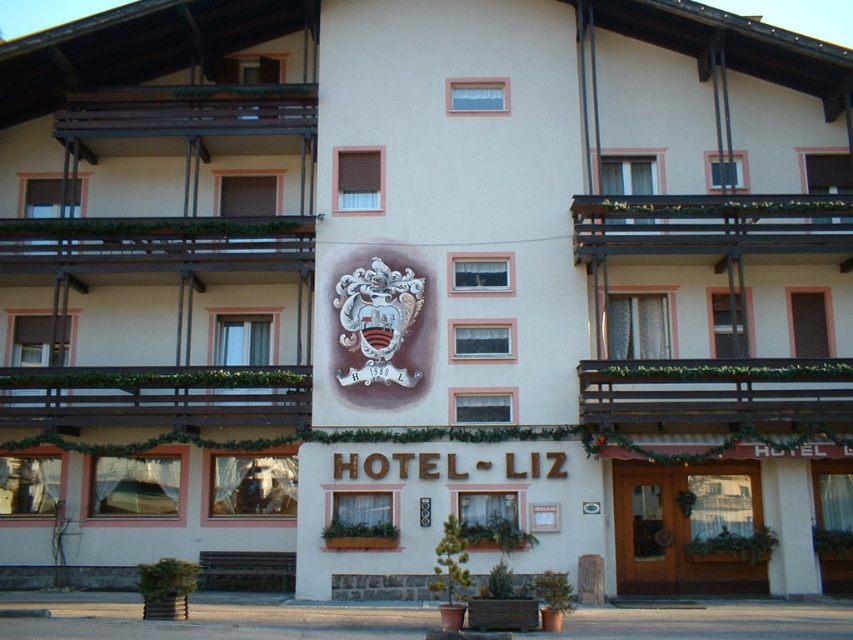
Question: Which of the following is the farthest from the observer?

Choices:
 (A) (166, 68)
 (B) (345, 346)

Answer: (A)

Question: In this image, where is white stucco building at center located relative to silver metallic coat of arms at center?

Choices:
 (A) right
 (B) left

Answer: (B)

Question: Can you confirm if white stucco building at center is positioned below silver metallic coat of arms at center?

Choices:
 (A) yes
 (B) no

Answer: (B)

Question: Which of the following is the farthest from the observer?

Choices:
 (A) silver metallic coat of arms at center
 (B) white stucco building at center

Answer: (A)

Question: Is white stucco building at center behind silver metallic coat of arms at center?

Choices:
 (A) no
 (B) yes

Answer: (A)